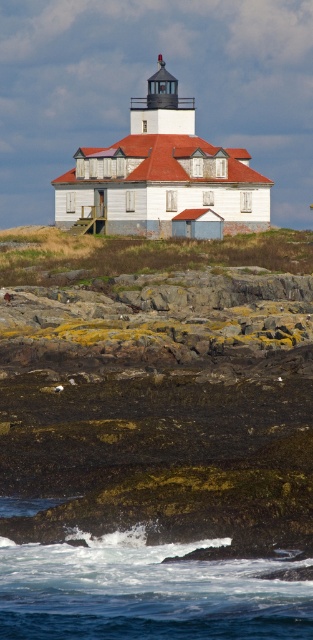
Question: Can you confirm if white frothy water at lower center is positioned to the left of white wooden lighthouse at center?

Choices:
 (A) no
 (B) yes

Answer: (A)

Question: Among these points, which one is nearest to the camera?

Choices:
 (A) (95, 612)
 (B) (167, 147)

Answer: (A)

Question: Does white frothy water at lower center lie in front of white wooden lighthouse at center?

Choices:
 (A) yes
 (B) no

Answer: (A)

Question: Which object is farther from the camera taking this photo?

Choices:
 (A) white frothy water at lower center
 (B) white wooden lighthouse at center

Answer: (B)

Question: Can you confirm if white frothy water at lower center is positioned below white wooden lighthouse at center?

Choices:
 (A) no
 (B) yes

Answer: (B)